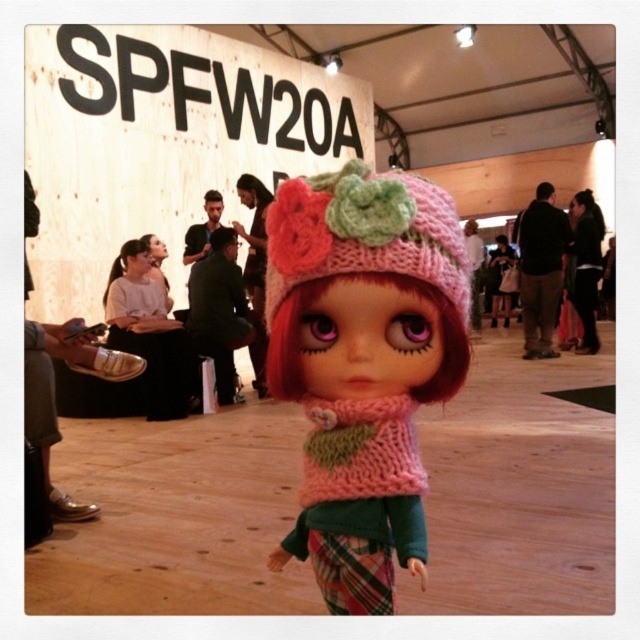
You are a photographer at the SPFW20A event and want to capture a closeup of the doll. The point at coordinates point (362, 364) is part of an important feature. Which object on the doll should you focus on to ensure the feature is in the frame?

The point at coordinates point (362, 364) is on the knitted pink hat at center, so you should focus on the knitted pink hat at center to ensure the feature is in the frame.

You are a fashion designer who wants to create a matching accessory for the knitted pink hat at center and the pink knitted hat at center. Which hat has a larger width to accommodate more decorative elements?

The pink knitted hat at center has a larger width than the knitted pink hat at center, so it can accommodate more decorative elements.